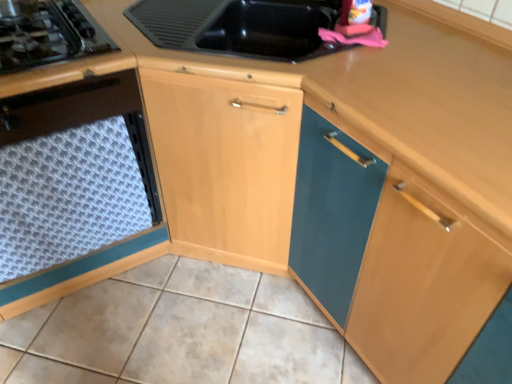
Question: Is wooden at upper right surrounded by black glass gas stove at left?

Choices:
 (A) yes
 (B) no

Answer: (B)

Question: Does black glass gas stove at left have a lesser height compared to wooden at upper right?

Choices:
 (A) no
 (B) yes

Answer: (B)

Question: Is black glass gas stove at left further to camera compared to wooden at upper right?

Choices:
 (A) yes
 (B) no

Answer: (A)

Question: Is black glass gas stove at left located outside wooden at upper right?

Choices:
 (A) no
 (B) yes

Answer: (B)

Question: Is black glass gas stove at left beside wooden at upper right?

Choices:
 (A) yes
 (B) no

Answer: (B)

Question: From the image's perspective, is black glass gas stove at left over wooden at upper right?

Choices:
 (A) yes
 (B) no

Answer: (A)

Question: From the image's perspective, is wooden at upper right located above white textured mat at lower left?

Choices:
 (A) no
 (B) yes

Answer: (A)

Question: Considering the relative positions of wooden at upper right and white textured mat at lower left in the image provided, is wooden at upper right to the right of white textured mat at lower left from the viewer's perspective?

Choices:
 (A) no
 (B) yes

Answer: (B)

Question: Would you say wooden at upper right is a long distance from white textured mat at lower left?

Choices:
 (A) yes
 (B) no

Answer: (B)

Question: Is wooden at upper right not inside white textured mat at lower left?

Choices:
 (A) yes
 (B) no

Answer: (A)

Question: Does wooden at upper right have a greater width compared to white textured mat at lower left?

Choices:
 (A) no
 (B) yes

Answer: (B)

Question: Does wooden at upper right have a greater height compared to white textured mat at lower left?

Choices:
 (A) yes
 (B) no

Answer: (B)

Question: From a real-world perspective, is white textured tile at lower center under black glass gas stove at left?

Choices:
 (A) yes
 (B) no

Answer: (A)